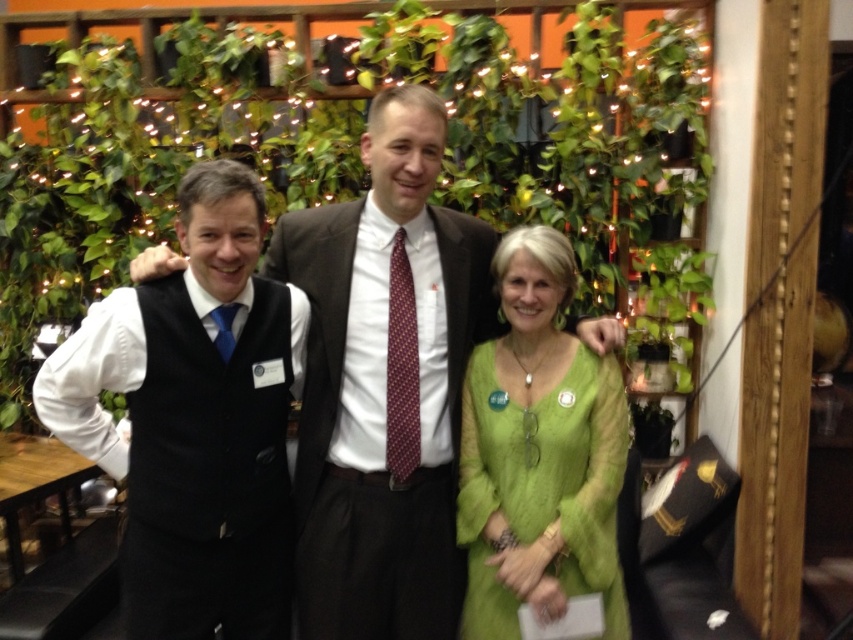
Question: Can you confirm if matte black vest at left is positioned to the left of green sheer dress at center?

Choices:
 (A) yes
 (B) no

Answer: (A)

Question: Which of these objects is positioned farthest from the matte black vest at left?

Choices:
 (A) green sheer dress at center
 (B) black wool vest at left

Answer: (B)

Question: Which of the following is the farthest from the observer?

Choices:
 (A) dark brown wool suit at center
 (B) black wool vest at left
 (C) matte black vest at left
 (D) green sheer dress at center

Answer: (A)

Question: Is matte black vest at left positioned at the back of green sheer dress at center?

Choices:
 (A) yes
 (B) no

Answer: (B)

Question: Does black wool vest at left have a greater width compared to dark brown wool suit at center?

Choices:
 (A) no
 (B) yes

Answer: (A)

Question: Estimate the real-world distances between objects in this image. Which object is closer to the dark brown wool suit at center?

Choices:
 (A) matte black vest at left
 (B) green sheer dress at center

Answer: (A)